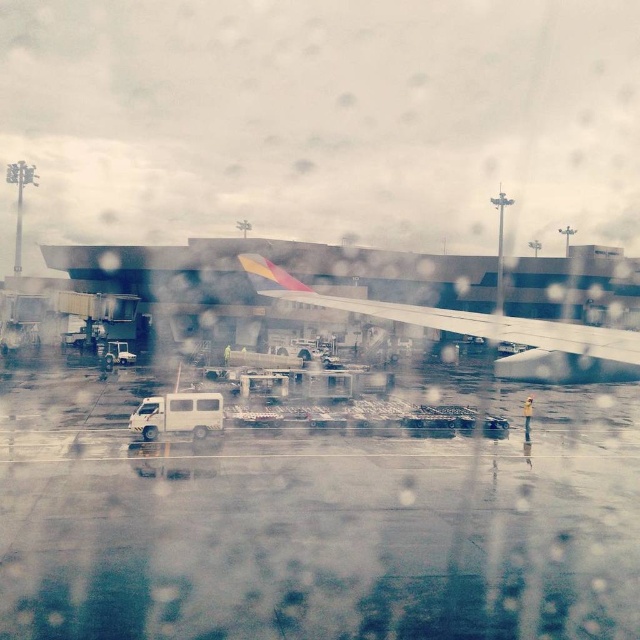
You are a passenger sitting in the aircraft and looking out the transparent glass airplane window at center. You notice the white rubber tarmac at center. In which direction relative to the window is the tarmac located?

The white rubber tarmac at center is to the right of the transparent glass airplane window at center.

You are a passenger sitting by the window of an aircraft. You see the white rubber tarmac at center and the white glossy van at center outside. Which object is closer to your window?

The white rubber tarmac at center is closer to your window because it is in front of the white glossy van at center.

You are a passenger sitting by the window of an aircraft. You see the white rubber tarmac at center and the white matte van at center through the raindrops. Which object is closer to you?

The white rubber tarmac at center is closer to the viewer than the white matte van at center.